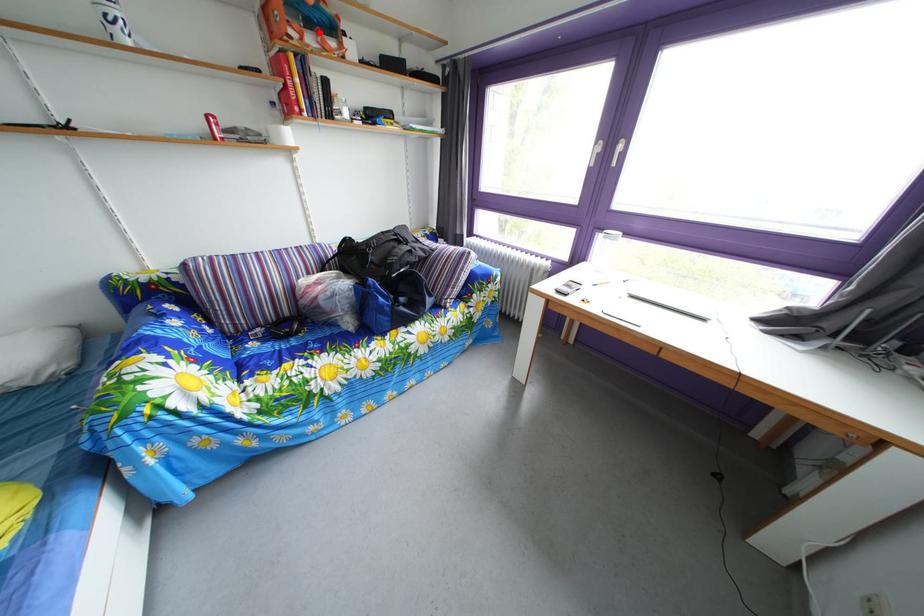
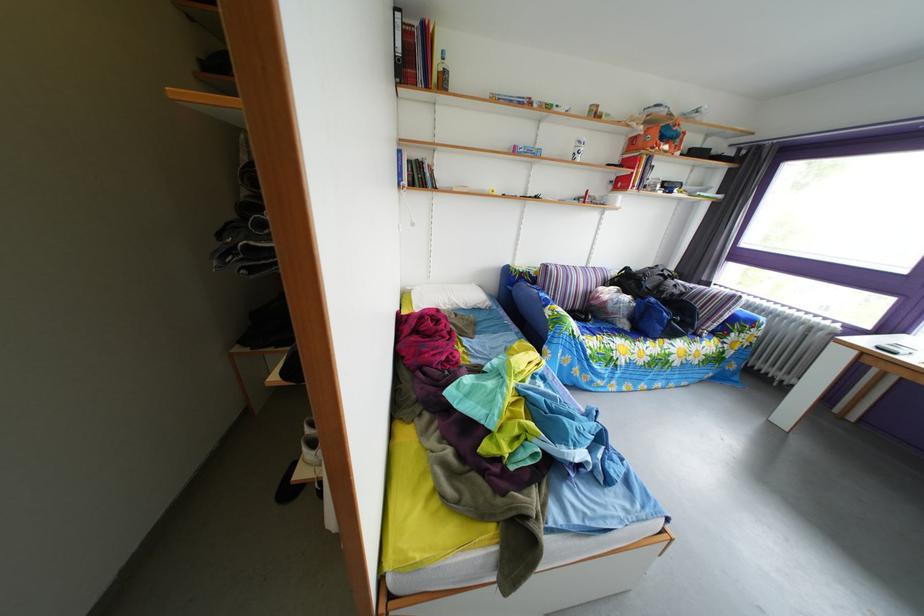
In the second image, find the point that corresponds to the highlighted location in the first image.

(673, 147)